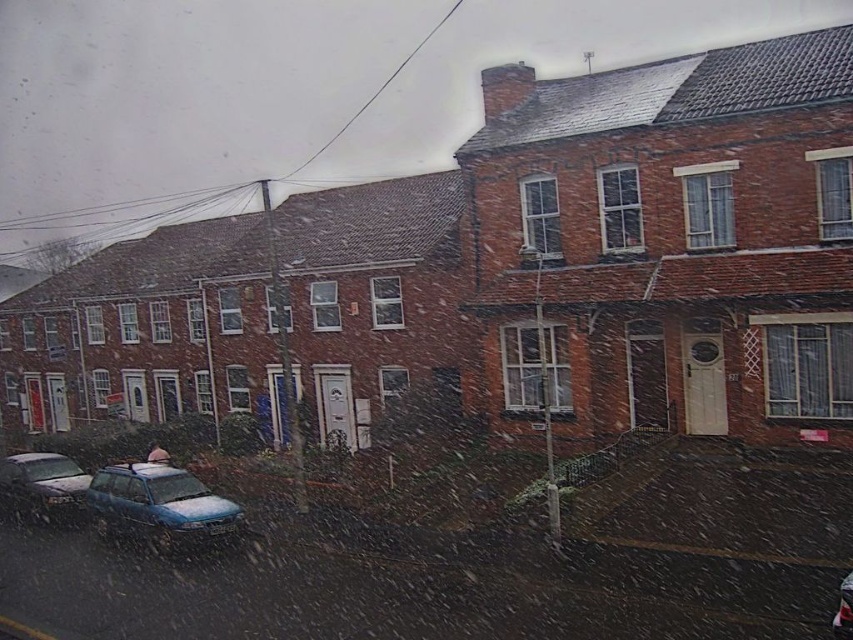
You are a delivery driver trying to park your 1.8 meters wide van in the snowy street. You see a metallic blue sedan at lower left and a metallic blue car at lower left. Can both vehicles fit side by side in the parking space without overlapping?

The metallic blue sedan at lower left might be wider than metallic blue car at lower left. Since the sedan is possibly wider, it is uncertain if both can fit side by side in the parking space without overlapping. You should check the exact width of both vehicles before deciding.

You are a delivery person trying to park your delivery van in the snowy street. You see a metallic blue sedan at lower left and a metallic blue car at lower left. Which vehicle should you avoid parking next to if you want to leave more space for other vehicles?

You should avoid parking next to the metallic blue sedan at lower left because it is larger in size than the metallic blue car at lower left, leaving less space for other vehicles.